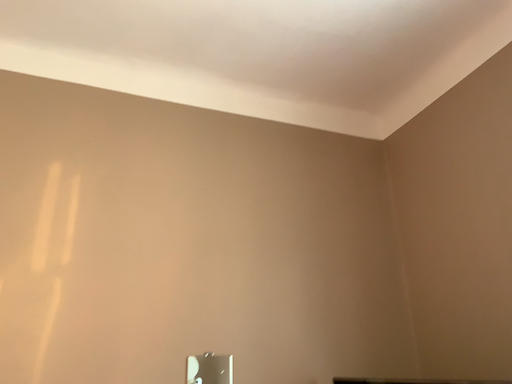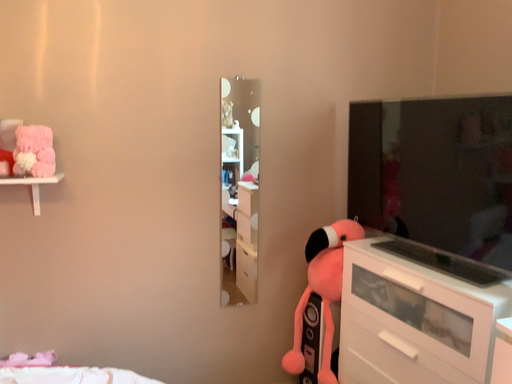
Question: Which way did the camera rotate in the video?

Choices:
 (A) rotated downward
 (B) rotated upward

Answer: (A)